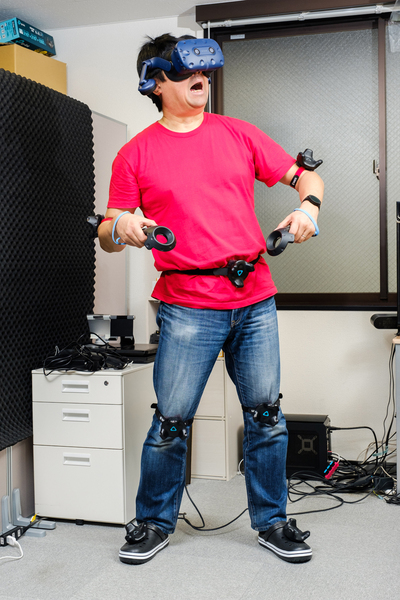
At what (x,y) coordinates should I click in order to perform the action: click on white plug in outlet. Please return your answer as a coordinate pair (x, y). Looking at the image, I should click on [12, 541].